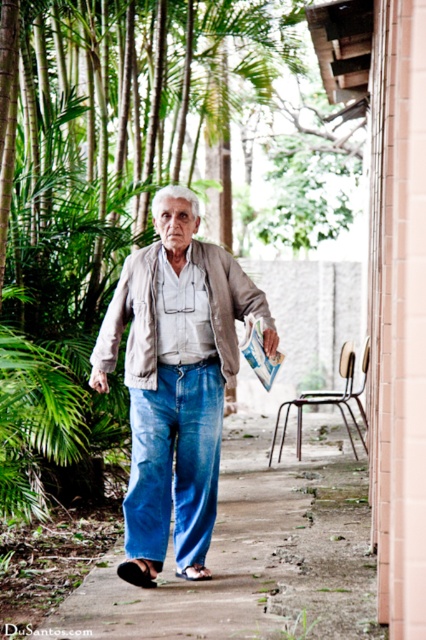
Between blue denim pants at center and blue denim jeans at center, which one appears on the right side from the viewer's perspective?

From the viewer's perspective, blue denim pants at center appears more on the right side.

Which of these two, blue denim pants at center or blue denim jeans at center, stands shorter?

With less height is blue denim pants at center.

This screenshot has height=640, width=426. What do you see at coordinates (255, 552) in the screenshot? I see `blue denim pants at center` at bounding box center [255, 552].

Identify the location of blue denim pants at center. Image resolution: width=426 pixels, height=640 pixels. (255, 552).

Is blue denim pants at center to the left of leather jacket at center from the viewer's perspective?

Incorrect, blue denim pants at center is not on the left side of leather jacket at center.

Is point (244, 588) more distant than point (149, 246)?

No, (244, 588) is in front of (149, 246).

Which is in front, point (94, 620) or point (134, 284)?

Point (94, 620) is in front.

The width and height of the screenshot is (426, 640). I want to click on blue denim pants at center, so click(x=255, y=552).

Which is behind, point (184, 465) or point (198, 579)?

The point (184, 465) is behind.

Describe the element at coordinates (175, 461) in the screenshot. The image size is (426, 640). I see `blue denim jeans at center` at that location.

Describe the element at coordinates (175, 461) in the screenshot. The image size is (426, 640). I see `blue denim jeans at center` at that location.

Find the location of a particular element. This screenshot has width=426, height=640. blue denim jeans at center is located at coordinates (175, 461).